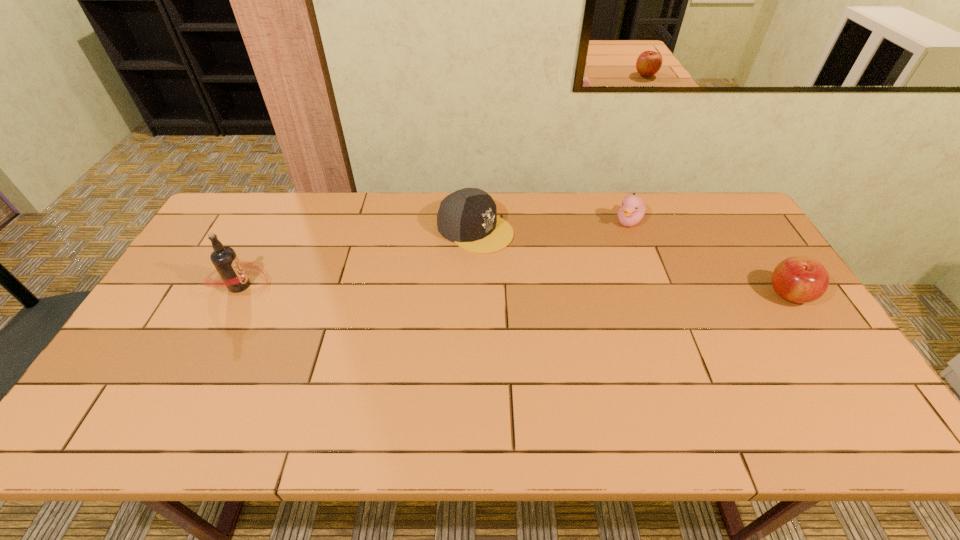
Image resolution: width=960 pixels, height=540 pixels. What are the coordinates of `root beer` in the screenshot? It's located at (230, 268).

You are a GUI agent. You are given a task and a screenshot of the screen. Output one action in this format:
    pyautogui.click(x=<x>, y=<y>)
    Task: Click on the tallest object
    Image resolution: width=960 pixels, height=540 pixels.
    Given the screenshot: What is the action you would take?
    pyautogui.click(x=230, y=268)

Find the location of a particular element. apple is located at coordinates (798, 279).

Find the location of a particular element. The height and width of the screenshot is (540, 960). the second object from right to left is located at coordinates (633, 208).

The image size is (960, 540). I want to click on the third object from right to left, so click(468, 217).

Image resolution: width=960 pixels, height=540 pixels. In order to click on blank space located 0.050m on the label of the tallest object in this screenshot , I will do `click(287, 286)`.

This screenshot has height=540, width=960. Identify the location of free space located on the stem of the apple. (675, 294).

Where is `vacant space situated 0.320m on the stem of the apple`? The width and height of the screenshot is (960, 540). vacant space situated 0.320m on the stem of the apple is located at coordinates (655, 294).

Find the location of `vacant space situated on the stem of the apple`. vacant space situated on the stem of the apple is located at coordinates [627, 294].

The width and height of the screenshot is (960, 540). Find the location of `vacant space located on the front-facing side of the third object from left to right`. vacant space located on the front-facing side of the third object from left to right is located at coordinates (582, 303).